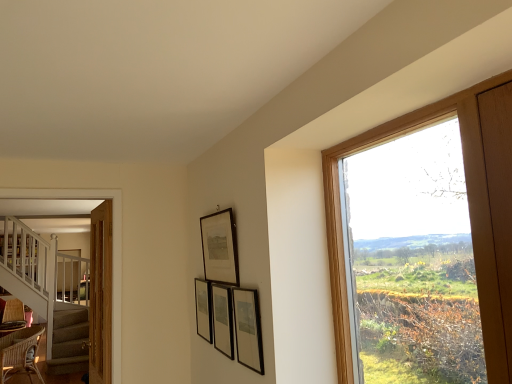
Question: Which direction should I rotate to look at matte black picture frame at center, acting as the second picture frame starting from the back, — up or down?

Choices:
 (A) down
 (B) up

Answer: (A)

Question: Is wooden frame at right further to the viewer compared to wicker chair at lower left?

Choices:
 (A) yes
 (B) no

Answer: (B)

Question: Is wooden frame at right positioned with its back to wicker chair at lower left?

Choices:
 (A) no
 (B) yes

Answer: (A)

Question: Considering the relative sizes of wooden frame at right and wicker chair at lower left in the image provided, is wooden frame at right shorter than wicker chair at lower left?

Choices:
 (A) no
 (B) yes

Answer: (A)

Question: From the image's perspective, is wooden frame at right over wicker chair at lower left?

Choices:
 (A) yes
 (B) no

Answer: (A)

Question: Is wooden frame at right facing towards wicker chair at lower left?

Choices:
 (A) yes
 (B) no

Answer: (B)

Question: Considering the relative sizes of wooden frame at right and wicker chair at lower left in the image provided, is wooden frame at right smaller than wicker chair at lower left?

Choices:
 (A) yes
 (B) no

Answer: (A)

Question: Can you confirm if matte black picture frame at upper center, which is counted as the 3th picture frame, starting from the back, is positioned to the right of matte black picture frame at center, the 3th picture frame positioned from the front?

Choices:
 (A) yes
 (B) no

Answer: (B)

Question: Considering the relative sizes of matte black picture frame at upper center, which is the 2th picture frame from front to back, and matte black picture frame at center, acting as the second picture frame starting from the back, in the image provided, is matte black picture frame at upper center, which is the 2th picture frame from front to back, wider than matte black picture frame at center, acting as the second picture frame starting from the back,?

Choices:
 (A) yes
 (B) no

Answer: (A)

Question: Could you tell me if matte black picture frame at upper center, which is counted as the 3th picture frame, starting from the back, is facing matte black picture frame at center, the 3th picture frame positioned from the front?

Choices:
 (A) yes
 (B) no

Answer: (B)

Question: Is matte black picture frame at upper center, which is counted as the 3th picture frame, starting from the back, positioned beyond the bounds of matte black picture frame at center, acting as the second picture frame starting from the back?

Choices:
 (A) no
 (B) yes

Answer: (B)

Question: Does matte black picture frame at upper center, which is the 2th picture frame from front to back, have a smaller size compared to matte black picture frame at center, the 3th picture frame positioned from the front?

Choices:
 (A) yes
 (B) no

Answer: (B)

Question: From the image's perspective, would you say matte black picture frame at upper center, which is the 2th picture frame from front to back, is shown under matte black picture frame at center, the 3th picture frame positioned from the front?

Choices:
 (A) no
 (B) yes

Answer: (A)

Question: From a real-world perspective, is wooden frame at right physically below matte black picture frame at center, which ranks as the 4th picture frame in back-to-front order?

Choices:
 (A) yes
 (B) no

Answer: (B)